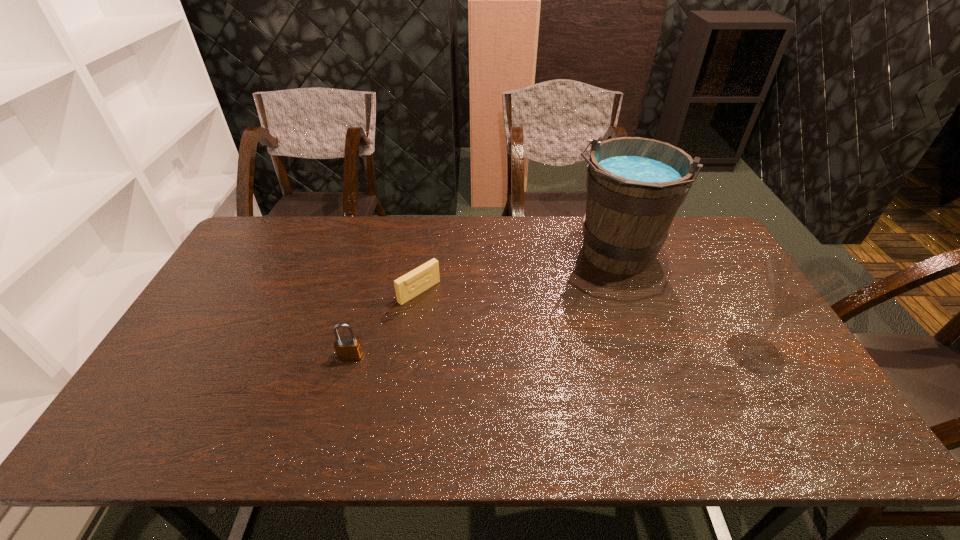
Locate an element on the screen. The height and width of the screenshot is (540, 960). the second shortest object is located at coordinates [x=347, y=348].

You are a GUI agent. You are given a task and a screenshot of the screen. Output one action in this format:
    pyautogui.click(x=<x>, y=<y>)
    Task: Click on the padlock
    
    Given the screenshot: What is the action you would take?
    pyautogui.click(x=347, y=348)

This screenshot has height=540, width=960. Identify the location of the rightmost object. (796, 283).

Find the location of a particular element. The image size is (960, 540). flute glass is located at coordinates (796, 283).

Locate an element on the screen. This screenshot has height=540, width=960. the third object from left to right is located at coordinates (635, 185).

What are the coordinates of `the tallest object` in the screenshot? It's located at (635, 185).

This screenshot has height=540, width=960. Identify the location of the second object from left to right. (408, 286).

Locate an element on the screen. The height and width of the screenshot is (540, 960). the shortest object is located at coordinates (408, 286).

Where is `vacant space located 0.270m on the right of the third tallest object`? vacant space located 0.270m on the right of the third tallest object is located at coordinates (466, 356).

Locate an element on the screen. The image size is (960, 540). vacant space situated 0.050m on the front of the rightmost object is located at coordinates (780, 396).